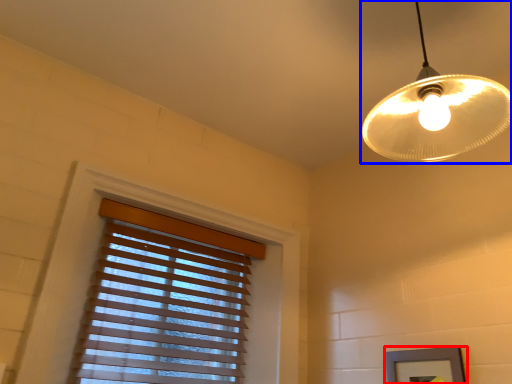
Question: Which of the following is the closest to the observer, picture frame (highlighted by a red box) or lamp (highlighted by a blue box)?

Choices:
 (A) picture frame
 (B) lamp

Answer: (B)